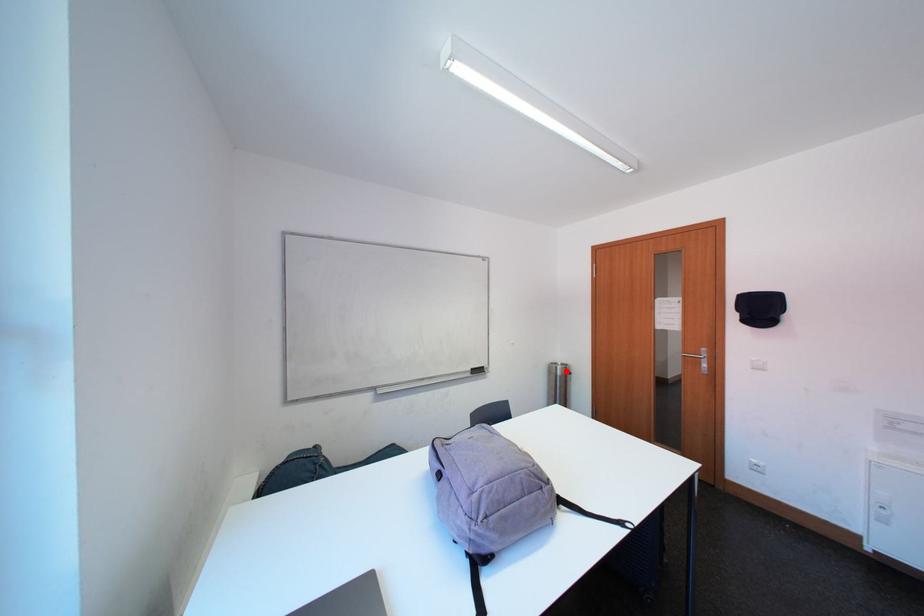
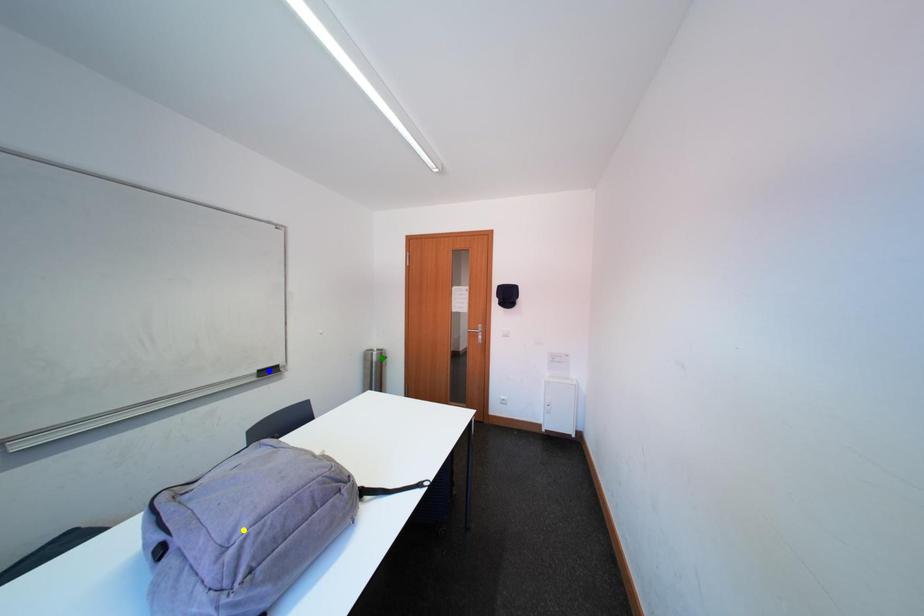
Question: I am providing you with two images of the same scene from different viewpoints. A red point is marked on the first image. You are given multiple points on the second image. Which point in image 2 is actually the same real-world point as the red point in image 1?

Choices:
 (A) green point
 (B) blue point
 (C) yellow point

Answer: (A)